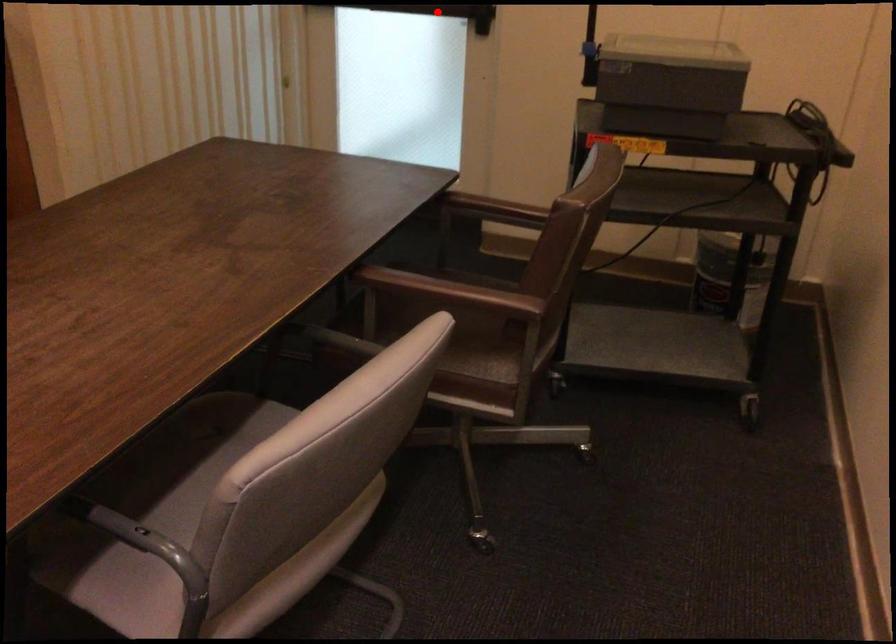
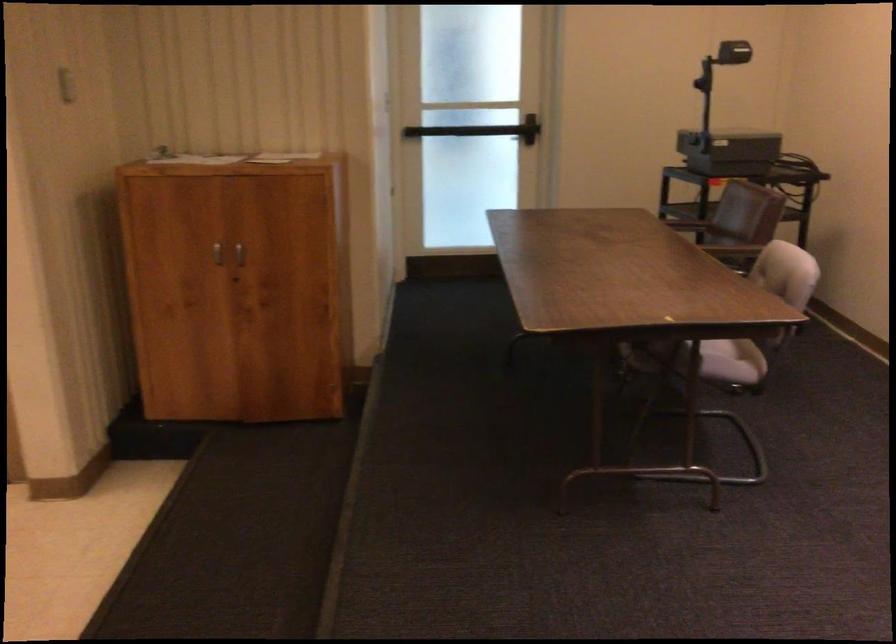
Question: I am providing you with two images of the same scene from different viewpoints. A red point is marked on the first image. At the location where the point appears in image 1, is it still visible in image 2?

Choices:
 (A) Yes
 (B) No

Answer: (B)